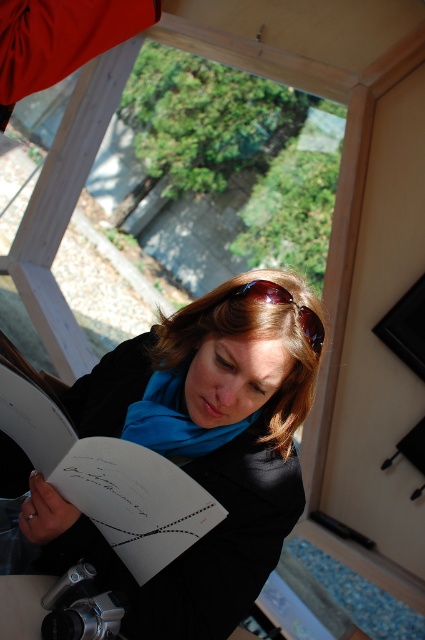
Question: Estimate the real-world distances between objects in this image. Which object is closer to the white paper book at center?

Choices:
 (A) brown leather sunglasses at center
 (B) black matte jacket at center
 (C) blue fabric scarf at center

Answer: (B)

Question: Estimate the real-world distances between objects in this image. Which object is farther from the white paper book at center?

Choices:
 (A) black matte jacket at center
 (B) brown leather sunglasses at center
 (C) blue fabric scarf at center

Answer: (B)

Question: Can you confirm if black matte jacket at center is wider than white paper book at center?

Choices:
 (A) no
 (B) yes

Answer: (B)

Question: Is black matte jacket at center smaller than brown leather sunglasses at center?

Choices:
 (A) yes
 (B) no

Answer: (B)

Question: Which object is farther from the camera taking this photo?

Choices:
 (A) brown leather sunglasses at center
 (B) black matte jacket at center

Answer: (A)

Question: Does white paper book at center have a lesser width compared to brown leather sunglasses at center?

Choices:
 (A) yes
 (B) no

Answer: (B)